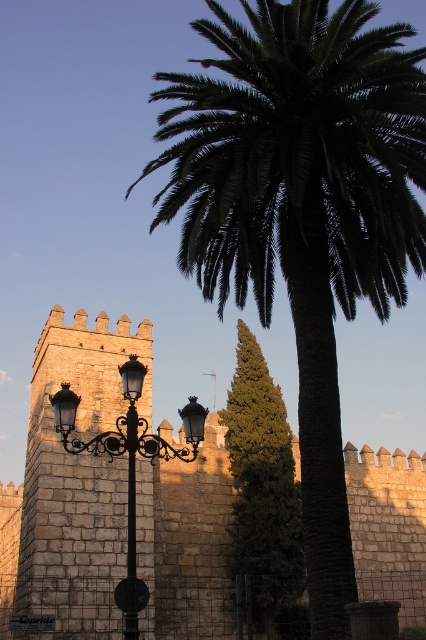
Question: Is stone wall at center smaller than black wrought iron street light at center?

Choices:
 (A) yes
 (B) no

Answer: (B)

Question: Which of the following is the closest to the observer?

Choices:
 (A) (115, 384)
 (B) (291, 630)

Answer: (A)

Question: Can you confirm if green leafy palm at center is thinner than stone wall at center?

Choices:
 (A) no
 (B) yes

Answer: (B)

Question: Is green leafy palm at center wider than black wrought iron street light at center?

Choices:
 (A) yes
 (B) no

Answer: (A)

Question: Which object is positioned closest to the black wrought iron street light at center?

Choices:
 (A) green leafy palm at center
 (B) stone wall at center
 (C) green textured pine tree at center

Answer: (B)

Question: Estimate the real-world distances between objects in this image. Which object is farther from the stone wall at center?

Choices:
 (A) green leafy palm at center
 (B) black wrought iron street light at center

Answer: (A)